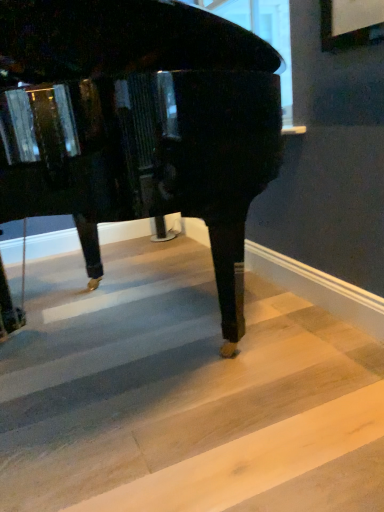
Question: From the image's perspective, is light wood stair at lower right beneath glossy black piano at center?

Choices:
 (A) yes
 (B) no

Answer: (A)

Question: Is glossy black piano at center inside light wood stair at lower right?

Choices:
 (A) no
 (B) yes

Answer: (A)

Question: Considering the relative sizes of light wood stair at lower right and glossy black piano at center in the image provided, is light wood stair at lower right bigger than glossy black piano at center?

Choices:
 (A) no
 (B) yes

Answer: (A)

Question: Is light wood stair at lower right outside glossy black piano at center?

Choices:
 (A) yes
 (B) no

Answer: (A)

Question: Is the depth of light wood stair at lower right greater than that of glossy black piano at center?

Choices:
 (A) no
 (B) yes

Answer: (B)

Question: Is light wood stair at lower right at the right side of glossy black piano at center?

Choices:
 (A) yes
 (B) no

Answer: (A)

Question: Is glossy black piano at center far away from light wood stair at lower right?

Choices:
 (A) yes
 (B) no

Answer: (B)

Question: Is glossy black piano at center turned away from light wood stair at lower right?

Choices:
 (A) no
 (B) yes

Answer: (A)

Question: Does glossy black piano at center contain light wood stair at lower right?

Choices:
 (A) no
 (B) yes

Answer: (A)

Question: From a real-world perspective, is glossy black piano at center positioned over light wood stair at lower right based on gravity?

Choices:
 (A) yes
 (B) no

Answer: (A)

Question: Is glossy black piano at center not within light wood stair at lower right?

Choices:
 (A) yes
 (B) no

Answer: (A)

Question: Can you confirm if glossy black piano at center is taller than light wood stair at lower right?

Choices:
 (A) no
 (B) yes

Answer: (B)

Question: In the image, is glossy black piano at center positioned in front of or behind light wood stair at lower right?

Choices:
 (A) behind
 (B) front

Answer: (B)